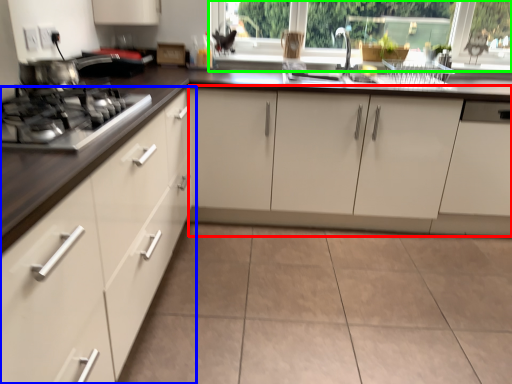
Question: Considering the real-world distances, which object is closest to cabinetry (highlighted by a red box)? cabinetry (highlighted by a blue box) or window frame (highlighted by a green box).

Choices:
 (A) cabinetry
 (B) window frame

Answer: (B)